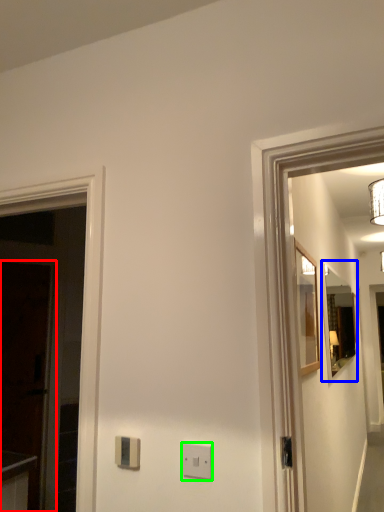
Question: Estimate the real-world distances between objects in this image. Which object is farther from glass door (highlighted by a red box), mirror (highlighted by a blue box) or light switch (highlighted by a green box)?

Choices:
 (A) mirror
 (B) light switch

Answer: (A)